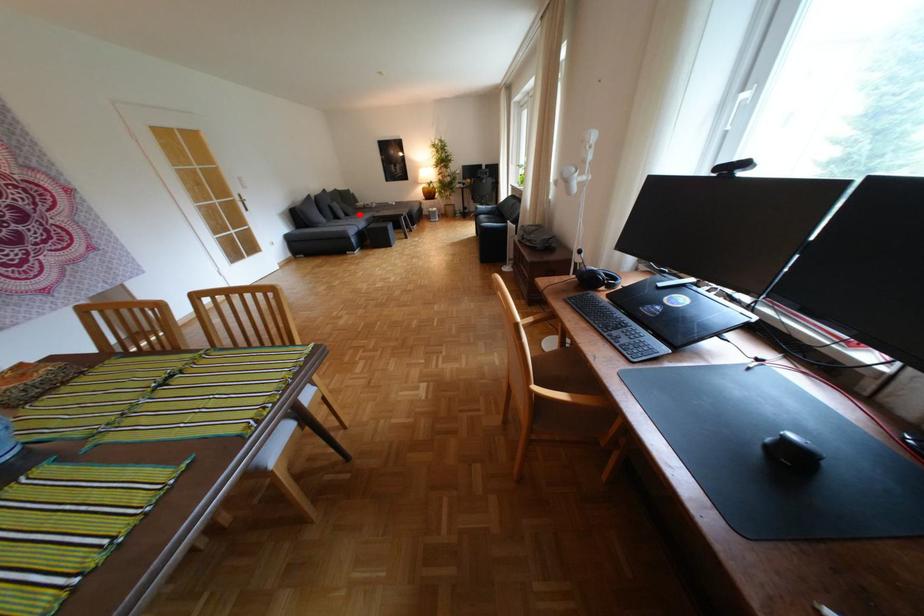
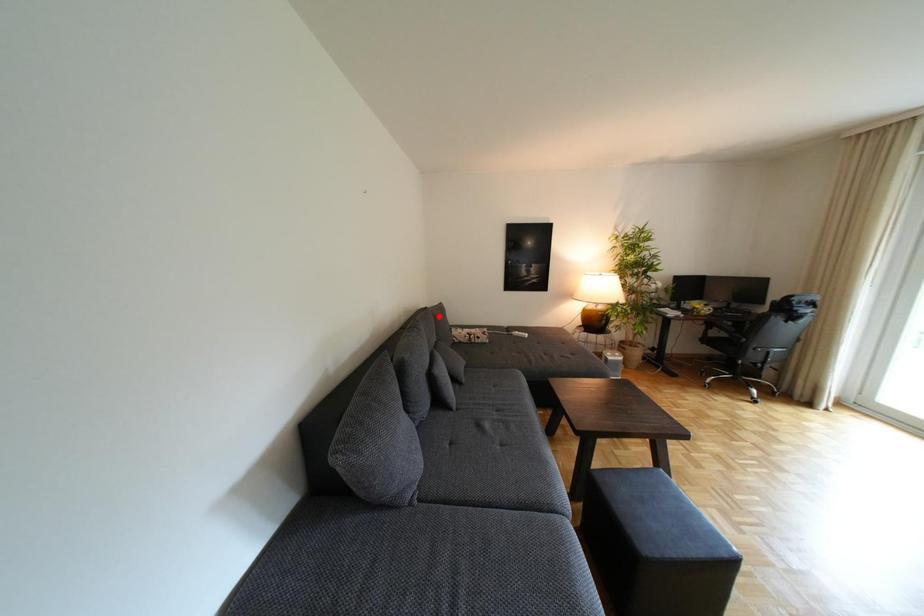
I am providing you with two images of the same scene from different viewpoints. A red point is marked on the first image and another point is marked on the second image. Does the point marked in image1 correspond to the same location as the one in image2?

No